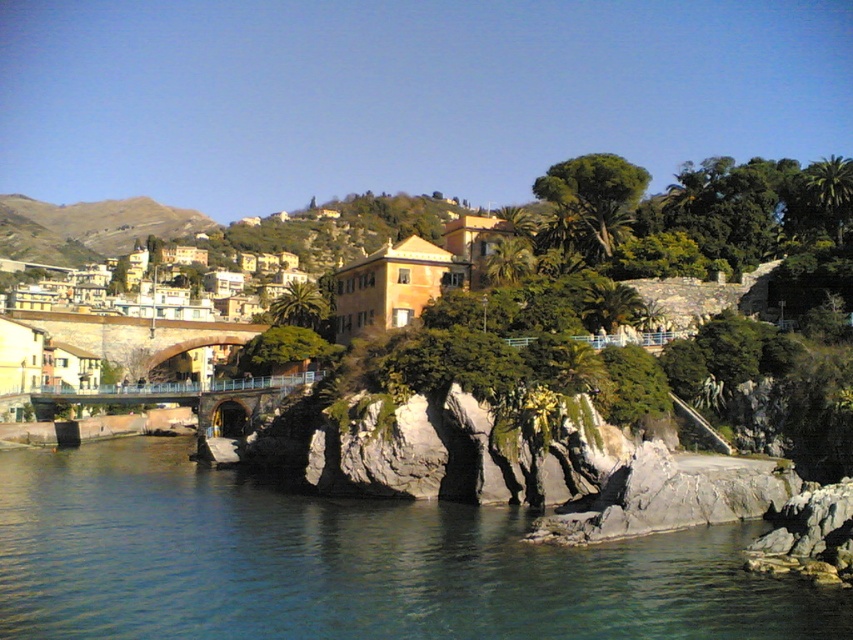
Question: Which point is farther from the camera taking this photo?

Choices:
 (A) (158, 221)
 (B) (132, 308)

Answer: (A)

Question: Is yellow stucco houses at upper left wider than metallic bridge at center?

Choices:
 (A) yes
 (B) no

Answer: (A)

Question: Considering the relative positions of clear water at lower left and metallic bridge at center in the image provided, where is clear water at lower left located with respect to metallic bridge at center?

Choices:
 (A) below
 (B) above

Answer: (A)

Question: Which object is positioned farthest from the yellowish stucco houses at upper left?

Choices:
 (A) clear water at lower left
 (B) metallic bridge at center
 (C) yellow stucco houses at upper left

Answer: (A)

Question: Does yellow stucco houses at upper left appear on the right side of metallic bridge at center?

Choices:
 (A) yes
 (B) no

Answer: (B)

Question: Which of the following is the farthest from the observer?

Choices:
 (A) (45, 212)
 (B) (213, 282)
 (C) (735, 532)
 (D) (126, 403)

Answer: (A)